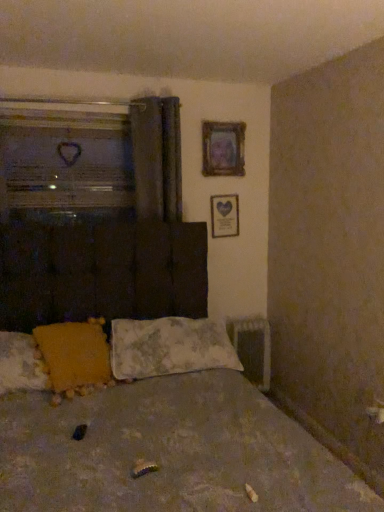
Question: From a real-world perspective, is transparent glass heart at upper left beneath wooden heart-shaped frame at upper right, the first picture frame ordered from the bottom?

Choices:
 (A) yes
 (B) no

Answer: (B)

Question: Does transparent glass heart at upper left have a lesser height compared to wooden heart-shaped frame at upper right, which appears as the 2th picture frame when viewed from the top?

Choices:
 (A) no
 (B) yes

Answer: (A)

Question: Could you tell me if transparent glass heart at upper left is facing wooden heart-shaped frame at upper right, the first picture frame ordered from the bottom?

Choices:
 (A) yes
 (B) no

Answer: (B)

Question: Does transparent glass heart at upper left appear on the right side of wooden heart-shaped frame at upper right, which appears as the 2th picture frame when viewed from the top?

Choices:
 (A) no
 (B) yes

Answer: (A)

Question: Considering the relative sizes of transparent glass heart at upper left and wooden heart-shaped frame at upper right, the first picture frame ordered from the bottom, in the image provided, is transparent glass heart at upper left taller than wooden heart-shaped frame at upper right, the first picture frame ordered from the bottom,?

Choices:
 (A) yes
 (B) no

Answer: (A)

Question: Based on their positions, is dark gray fabric curtain at upper center located to the left or right of wooden heart-shaped frame at upper right, which appears as the 2th picture frame when viewed from the top?

Choices:
 (A) right
 (B) left

Answer: (B)

Question: From the image's perspective, relative to wooden heart-shaped frame at upper right, which appears as the 2th picture frame when viewed from the top, is dark gray fabric curtain at upper center above or below?

Choices:
 (A) above
 (B) below

Answer: (A)

Question: Would you say dark gray fabric curtain at upper center is inside or outside wooden heart-shaped frame at upper right, which appears as the 2th picture frame when viewed from the top?

Choices:
 (A) outside
 (B) inside

Answer: (A)

Question: Considering the positions of point (180, 150) and point (233, 205), is point (180, 150) closer or farther from the camera than point (233, 205)?

Choices:
 (A) closer
 (B) farther

Answer: (A)

Question: Is wooden frame at upper center, the first picture frame positioned from the top, wider or thinner than yellow fabric pillow at lower left, which is the 2th pillow in right-to-left order?

Choices:
 (A) thin
 (B) wide

Answer: (A)

Question: Is wooden frame at upper center, the first picture frame positioned from the top, situated inside yellow fabric pillow at lower left, which is counted as the first pillow, starting from the left, or outside?

Choices:
 (A) inside
 (B) outside

Answer: (B)

Question: From the image's perspective, is wooden frame at upper center, arranged as the 2th picture frame when ordered from the bottom, located above or below yellow fabric pillow at lower left, which is the 2th pillow in right-to-left order?

Choices:
 (A) below
 (B) above

Answer: (B)

Question: In the image, is wooden frame at upper center, the first picture frame positioned from the top, positioned in front of or behind yellow fabric pillow at lower left, which is counted as the first pillow, starting from the left?

Choices:
 (A) front
 (B) behind

Answer: (B)

Question: From the image's perspective, relative to wooden heart-shaped frame at upper right, the first picture frame ordered from the bottom, is fluffy white pillow at center, the 1th pillow positioned from the right, above or below?

Choices:
 (A) below
 (B) above

Answer: (A)

Question: Looking at their shapes, would you say fluffy white pillow at center, the 1th pillow positioned from the right, is wider or thinner than wooden heart-shaped frame at upper right, the first picture frame ordered from the bottom?

Choices:
 (A) wide
 (B) thin

Answer: (A)